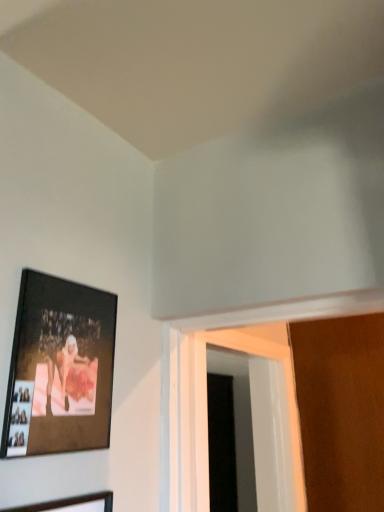
This screenshot has height=512, width=384. What do you see at coordinates (72, 504) in the screenshot? I see `wooden picture frame at lower left, the second picture frame from the top` at bounding box center [72, 504].

Measure the distance between point (107, 380) and camera.

Point (107, 380) and camera are 3.78 feet apart.

The image size is (384, 512). Identify the location of wooden picture frame at lower left, acting as the first picture frame starting from the bottom. (72, 504).

Looking at this image, from a real-world perspective, is matte black picture frame at upper left, the first picture frame viewed from the top, physically located above or below white plastic door at lower right?

matte black picture frame at upper left, the first picture frame viewed from the top, is above white plastic door at lower right.

From the image's perspective, which one is positioned lower, matte black picture frame at upper left, which is the second picture frame in bottom-to-top order, or white plastic door at lower right?

From the image's view, white plastic door at lower right is below.

Which object is further away from the camera, matte black picture frame at upper left, which is the second picture frame in bottom-to-top order, or white plastic door at lower right?

white plastic door at lower right is behind.

Is point (87, 417) more distant than point (301, 459)?

No, it is in front of (301, 459).

Is wooden picture frame at lower left, acting as the first picture frame starting from the bottom, completely or partially outside of white plastic door at lower right?

wooden picture frame at lower left, acting as the first picture frame starting from the bottom, is positioned outside white plastic door at lower right.

Considering the sizes of objects wooden picture frame at lower left, the second picture frame from the top, and white plastic door at lower right in the image provided, who is shorter, wooden picture frame at lower left, the second picture frame from the top, or white plastic door at lower right?

With less height is wooden picture frame at lower left, the second picture frame from the top.

From the picture: Which point is more forward, (86, 505) or (275, 344)?

The point (86, 505) is closer.

Is wooden picture frame at lower left, acting as the first picture frame starting from the bottom, oriented away from white plastic door at lower right?

That's not correct — wooden picture frame at lower left, acting as the first picture frame starting from the bottom, is not looking away from white plastic door at lower right.

From the image's perspective, is white plastic door at lower right located above or below matte black picture frame at upper left, which is the second picture frame in bottom-to-top order?

Based on their image positions, white plastic door at lower right is located beneath matte black picture frame at upper left, which is the second picture frame in bottom-to-top order.

From a real-world perspective, is white plastic door at lower right on top of matte black picture frame at upper left, which is the second picture frame in bottom-to-top order?

No, from a real-world perspective, white plastic door at lower right is not on top of matte black picture frame at upper left, which is the second picture frame in bottom-to-top order.

Does white plastic door at lower right have a greater height compared to matte black picture frame at upper left, the first picture frame viewed from the top?

Yes, white plastic door at lower right is taller than matte black picture frame at upper left, the first picture frame viewed from the top.

Is wooden picture frame at lower left, the second picture frame from the top, far away from matte black picture frame at upper left, which is the second picture frame in bottom-to-top order?

wooden picture frame at lower left, the second picture frame from the top, is near matte black picture frame at upper left, which is the second picture frame in bottom-to-top order, not far away.

Is wooden picture frame at lower left, the second picture frame from the top, facing towards matte black picture frame at upper left, which is the second picture frame in bottom-to-top order?

No, wooden picture frame at lower left, the second picture frame from the top, is not facing towards matte black picture frame at upper left, which is the second picture frame in bottom-to-top order.

Who is smaller, wooden picture frame at lower left, acting as the first picture frame starting from the bottom, or matte black picture frame at upper left, the first picture frame viewed from the top?

With smaller size is wooden picture frame at lower left, acting as the first picture frame starting from the bottom.

Is wooden picture frame at lower left, the second picture frame from the top, further to the viewer compared to matte black picture frame at upper left, the first picture frame viewed from the top?

No, wooden picture frame at lower left, the second picture frame from the top, is closer to the viewer.

From a real-world perspective, between matte black picture frame at upper left, which is the second picture frame in bottom-to-top order, and wooden picture frame at lower left, the second picture frame from the top, who is vertically higher?

matte black picture frame at upper left, which is the second picture frame in bottom-to-top order, is physically above.

Can you confirm if matte black picture frame at upper left, the first picture frame viewed from the top, is positioned to the right of wooden picture frame at lower left, acting as the first picture frame starting from the bottom?

Incorrect, matte black picture frame at upper left, the first picture frame viewed from the top, is not on the right side of wooden picture frame at lower left, acting as the first picture frame starting from the bottom.

Between point (197, 508) and point (39, 509), which one is positioned behind?

The point (197, 508) is behind.

Is white plastic door at lower right positioned far away from wooden picture frame at lower left, the second picture frame from the top?

white plastic door at lower right is actually quite close to wooden picture frame at lower left, the second picture frame from the top.

Considering the positions of objects white plastic door at lower right and wooden picture frame at lower left, the second picture frame from the top, in the image provided, who is behind, white plastic door at lower right or wooden picture frame at lower left, the second picture frame from the top,?

white plastic door at lower right is further from the camera.

Is white plastic door at lower right looking in the opposite direction of wooden picture frame at lower left, the second picture frame from the top?

white plastic door at lower right is not turned away from wooden picture frame at lower left, the second picture frame from the top.

Find the location of a particular element. This screenshot has height=512, width=384. the 2nd picture frame to the left of the white plastic door at lower right, counting from the anchor's position is located at coordinates (60, 368).

At what (x,y) coordinates should I click in order to perform the action: click on window that appears on the right of wooden picture frame at lower left, acting as the first picture frame starting from the bottom. Please return your answer as a coordinate pair (x, y). The height and width of the screenshot is (512, 384). Looking at the image, I should click on (206, 408).

Looking at the image, which one is located closer to wooden picture frame at lower left, the second picture frame from the top, white plastic door at lower right or matte black picture frame at upper left, which is the second picture frame in bottom-to-top order?

Among the two, matte black picture frame at upper left, which is the second picture frame in bottom-to-top order, is located nearer to wooden picture frame at lower left, the second picture frame from the top.

When comparing their distances from matte black picture frame at upper left, which is the second picture frame in bottom-to-top order, does wooden picture frame at lower left, the second picture frame from the top, or white plastic door at lower right seem closer?

Among the two, wooden picture frame at lower left, the second picture frame from the top, is located nearer to matte black picture frame at upper left, which is the second picture frame in bottom-to-top order.

In the scene shown: From the image, which object appears to be nearer to matte black picture frame at upper left, the first picture frame viewed from the top, white plastic door at lower right or wooden picture frame at lower left, the second picture frame from the top?

Among the two, wooden picture frame at lower left, the second picture frame from the top, is located nearer to matte black picture frame at upper left, the first picture frame viewed from the top.

Estimate the real-world distances between objects in this image. Which object is closer to white plastic door at lower right, wooden picture frame at lower left, acting as the first picture frame starting from the bottom, or matte black picture frame at upper left, which is the second picture frame in bottom-to-top order?

matte black picture frame at upper left, which is the second picture frame in bottom-to-top order, is positioned closer to the anchor white plastic door at lower right.

Based on their spatial positions, is matte black picture frame at upper left, the first picture frame viewed from the top, or white plastic door at lower right further from wooden picture frame at lower left, the second picture frame from the top?

Among the two, white plastic door at lower right is located further to wooden picture frame at lower left, the second picture frame from the top.

Looking at the image, which one is located closer to white plastic door at lower right, matte black picture frame at upper left, the first picture frame viewed from the top, or wooden picture frame at lower left, the second picture frame from the top?

matte black picture frame at upper left, the first picture frame viewed from the top, lies closer to white plastic door at lower right than the other object.

Find the location of a particular element. picture frame between wooden picture frame at lower left, the second picture frame from the top, and white plastic door at lower right in the front-back direction is located at coordinates (60, 368).